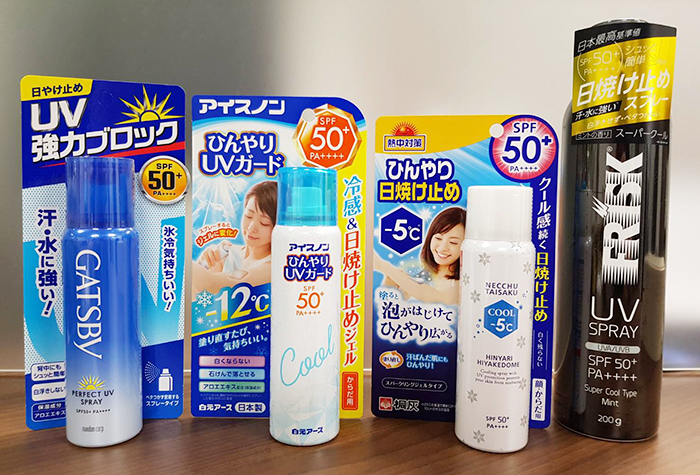
Locate an element on the screen. Image resolution: width=700 pixels, height=475 pixels. tan wall is located at coordinates (425, 50).